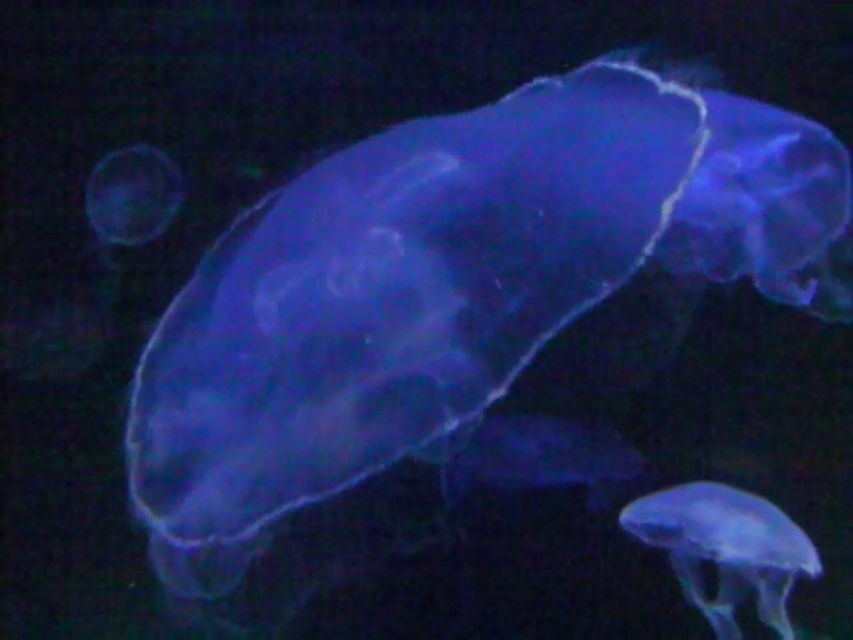
You are observing the image of the jellyfish. There are two points in the image, point A at point (705,525) and point B at point (164,224). Which point is closer to the camera?

Point A at point (705,525) is closer to the camera than point B at point (164,224).

You are an underwater photographer aiming to capture the largest jellyfish in the image. You see the translucent blue jellyfish at center and the translucent blue jellyfish at lower right. Which one should you focus on to photograph the largest one?

The translucent blue jellyfish at center is larger in size compared to the translucent blue jellyfish at lower right, so you should focus on the translucent blue jellyfish at center to photograph the largest one.

You are a photographer trying to capture the jellyfish in the center. You notice two points in the image labeled as point (x=602, y=88) and point (x=146, y=161). Which point is nearer to your camera lens?

Point (x=602, y=88) is closer to the camera than point (x=146, y=161).